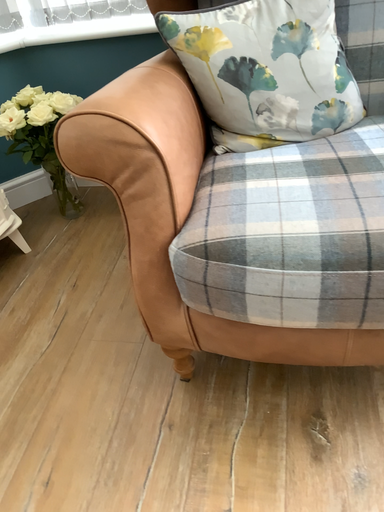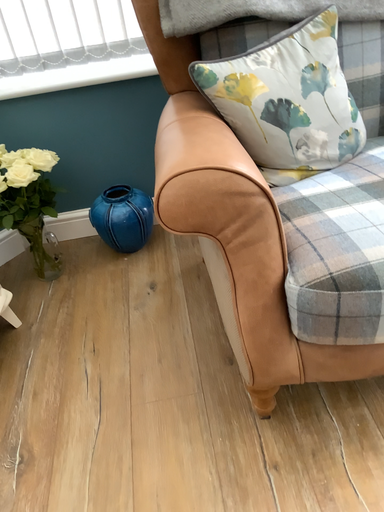
Question: Which way did the camera rotate in the video?

Choices:
 (A) rotated left
 (B) rotated right

Answer: (B)